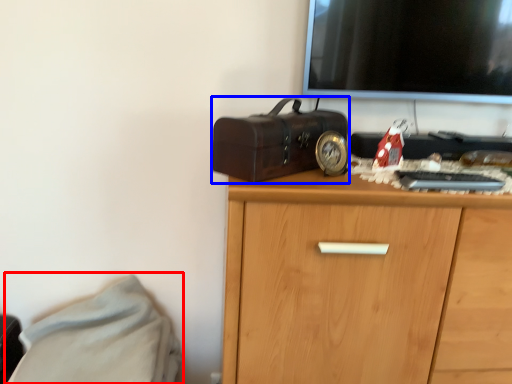
Question: Among these objects, which one is nearest to the camera, bed (highlighted by a red box) or suitcase (highlighted by a blue box)?

Choices:
 (A) bed
 (B) suitcase

Answer: (B)